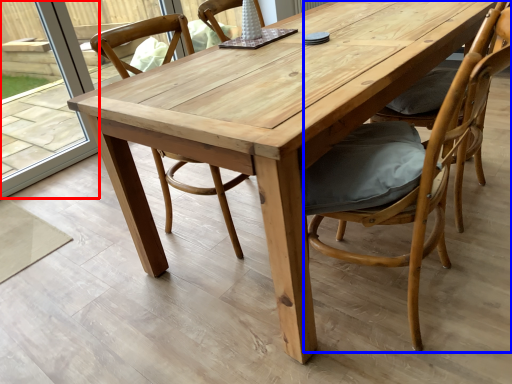
Question: Which of the following is the farthest to the observer, glass door (highlighted by a red box) or chair (highlighted by a blue box)?

Choices:
 (A) glass door
 (B) chair

Answer: (A)